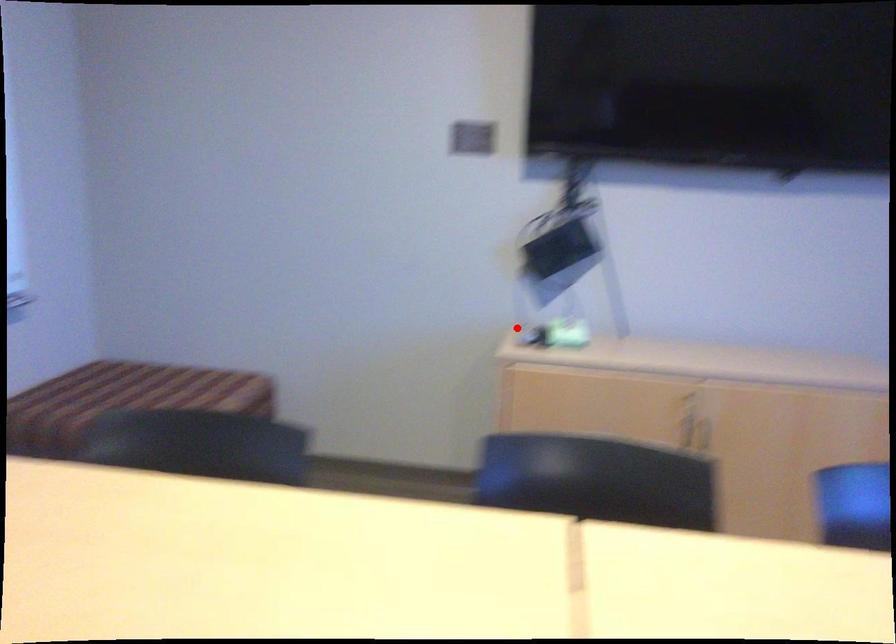
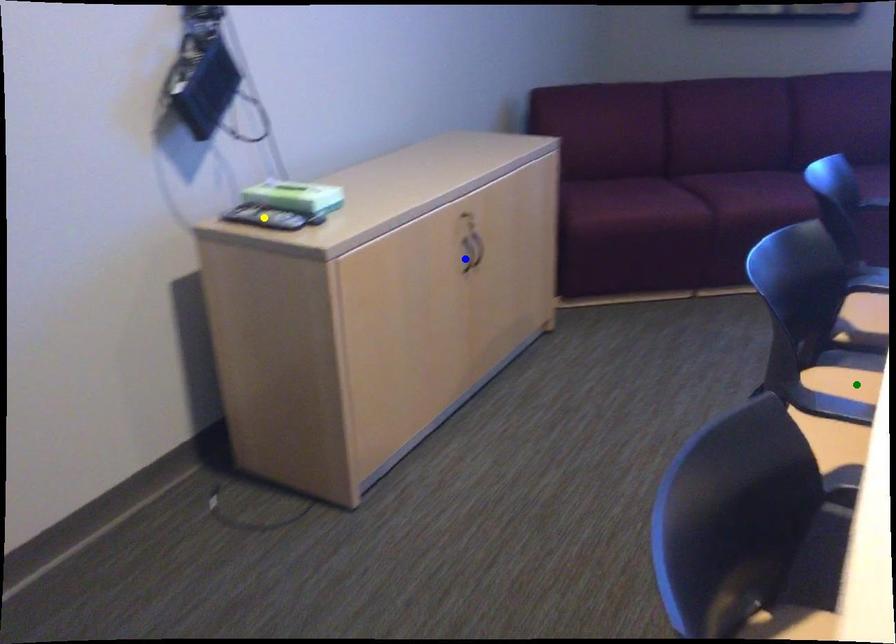
Question: I am providing you with two images of the same scene from different viewpoints. A red point is marked on the first image. You are given multiple points on the second image. Which point in image 2 is actually the same real-world point as the red point in image 1?

Choices:
 (A) blue point
 (B) green point
 (C) yellow point

Answer: (C)